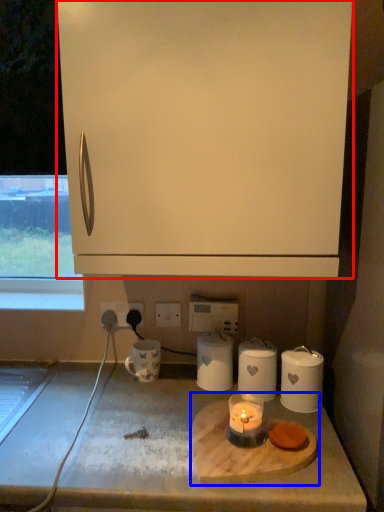
Question: Which object is further to the camera taking this photo, cabinetry (highlighted by a red box) or appliance (highlighted by a blue box)?

Choices:
 (A) cabinetry
 (B) appliance

Answer: (B)